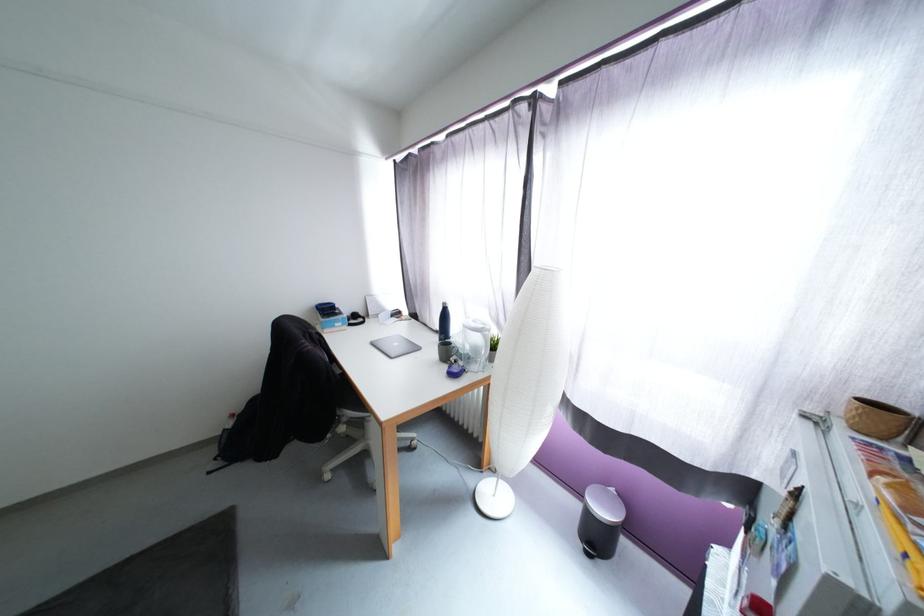
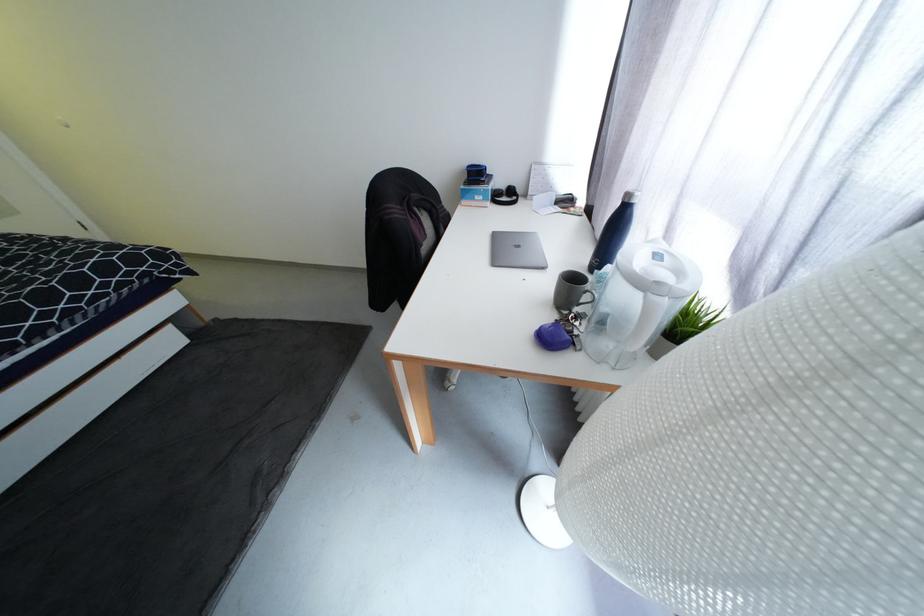
In the second image, find the point that corresponds to the point at 357,326 in the first image.

(499, 203)